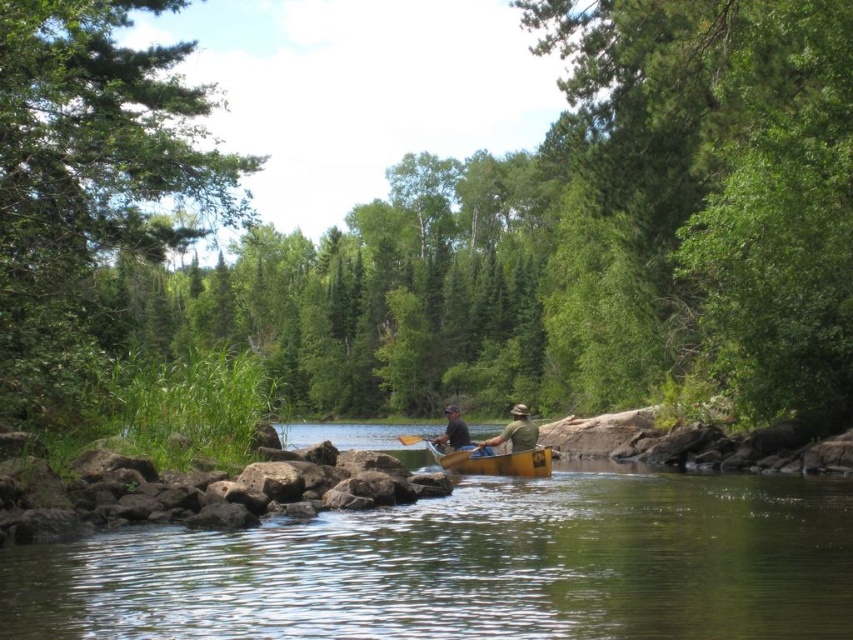
Question: Is yellow wood canoe at center below green fabric hat at center?

Choices:
 (A) no
 (B) yes

Answer: (B)

Question: Is green leafy tree at left positioned in front of wooden paddle at center?

Choices:
 (A) yes
 (B) no

Answer: (A)

Question: Which object is closer to the camera taking this photo?

Choices:
 (A) wooden paddle at center
 (B) yellow wood canoe at center

Answer: (B)

Question: Among these objects, which one is nearest to the camera?

Choices:
 (A) dark green fabric shirt at center
 (B) green fabric hat at center

Answer: (B)

Question: Does green leafy tree at center appear on the left side of green leafy tree at left?

Choices:
 (A) no
 (B) yes

Answer: (A)

Question: Which point appears farthest from the camera in this image?

Choices:
 (A) (553, 186)
 (B) (0, 321)
 (C) (460, 465)
 (D) (492, 440)

Answer: (A)